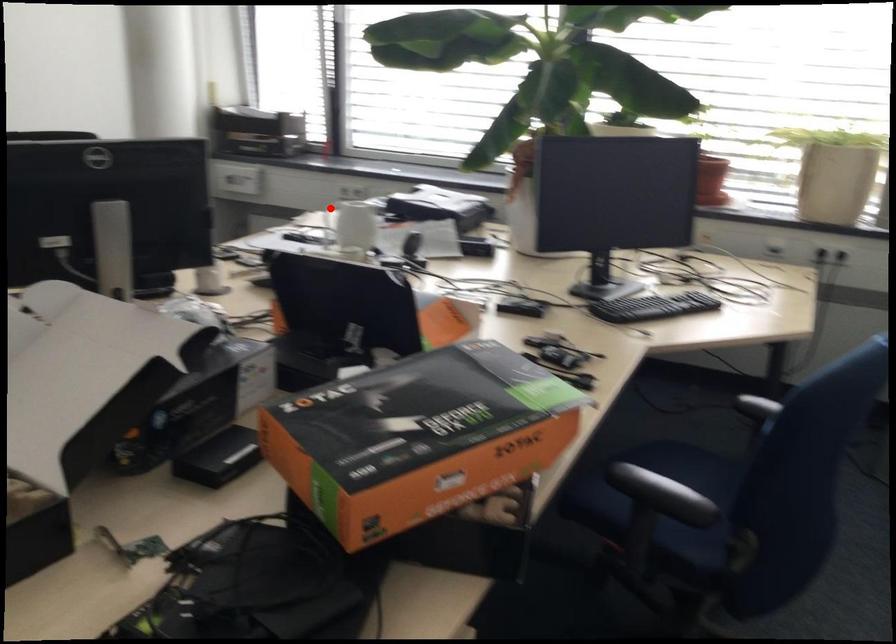
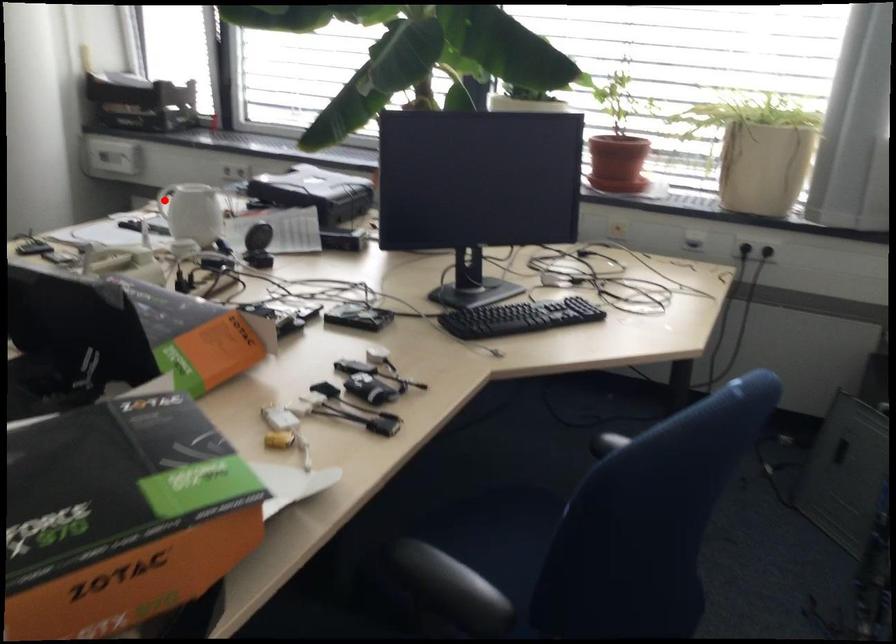
I am providing you with two images of the same scene from different viewpoints. A red point is marked on the first image and another point is marked on the second image. Are the points marked in image1 and image2 representing the same 3D position?

Yes